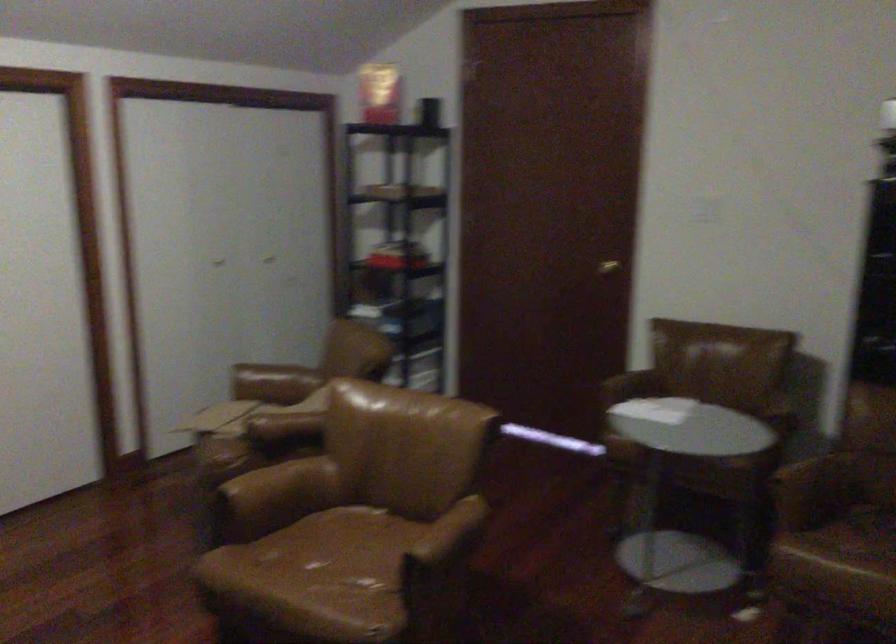
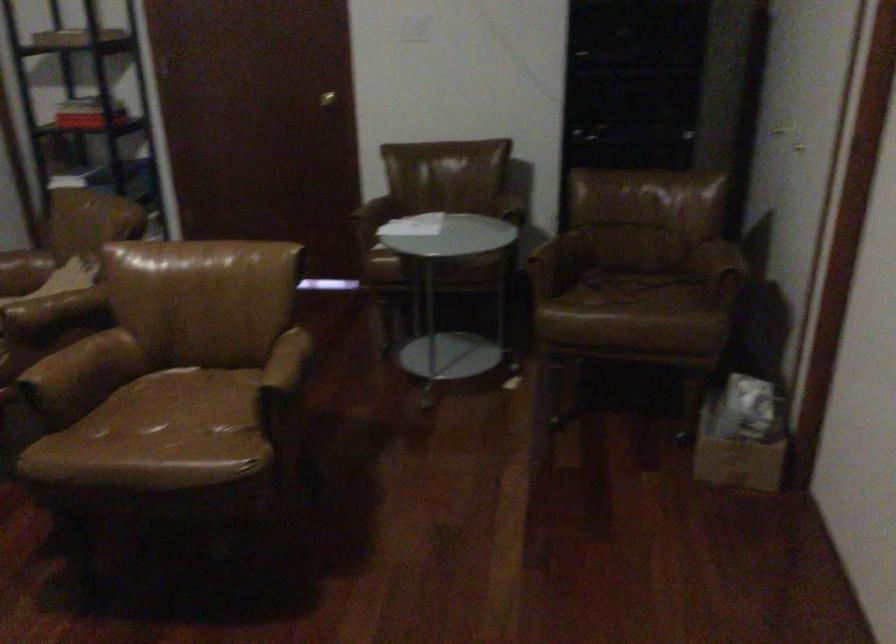
Where in the second image is the point corresponding to the point at 435,545 from the first image?

(283, 371)